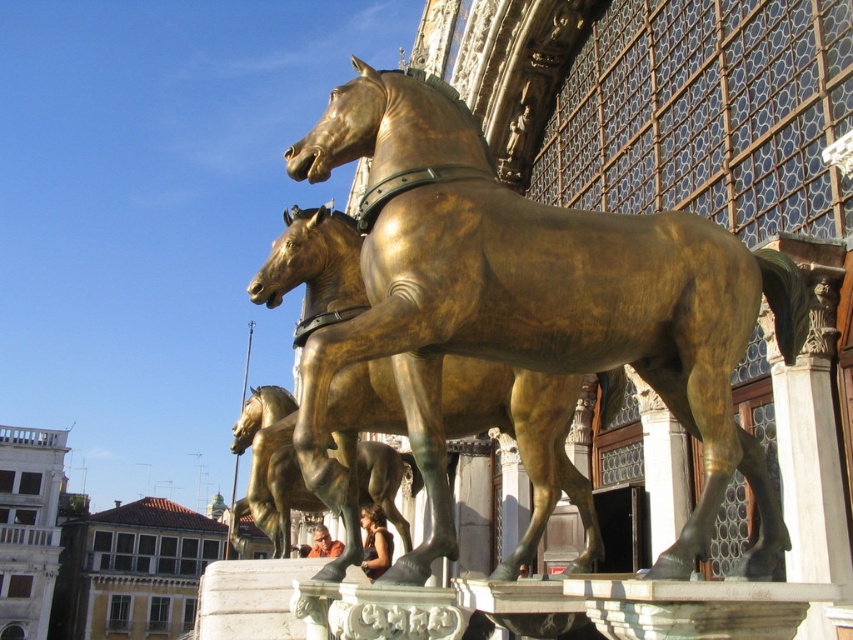
Question: Which of the following is the farthest from the observer?

Choices:
 (A) shiny gold horse at center
 (B) gold polished bronze horse at center
 (C) golden polished horse at center

Answer: (A)

Question: Can you confirm if golden polished horse at center is positioned to the left of shiny gold horse at center?

Choices:
 (A) no
 (B) yes

Answer: (A)

Question: Is golden polished horse at center further to camera compared to shiny gold horse at center?

Choices:
 (A) no
 (B) yes

Answer: (A)

Question: Among these objects, which one is farthest from the camera?

Choices:
 (A) shiny gold horse at center
 (B) golden polished horse at center
 (C) gold polished bronze horse at center

Answer: (A)

Question: Among these points, which one is nearest to the camera?

Choices:
 (A) (426, 454)
 (B) (364, 467)
 (C) (271, 461)

Answer: (A)

Question: Is gold polished bronze horse at center above golden polished horse at center?

Choices:
 (A) yes
 (B) no

Answer: (A)